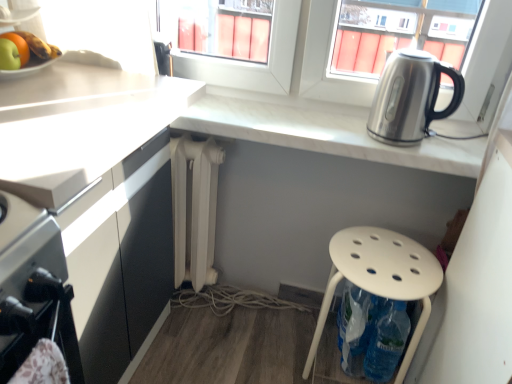
At what (x,y) coordinates should I click in order to perform the action: click on free space to the left of stainless steel kettle at upper right. Please return your answer as a coordinate pair (x, y). The image size is (512, 384). Looking at the image, I should click on coord(335,121).